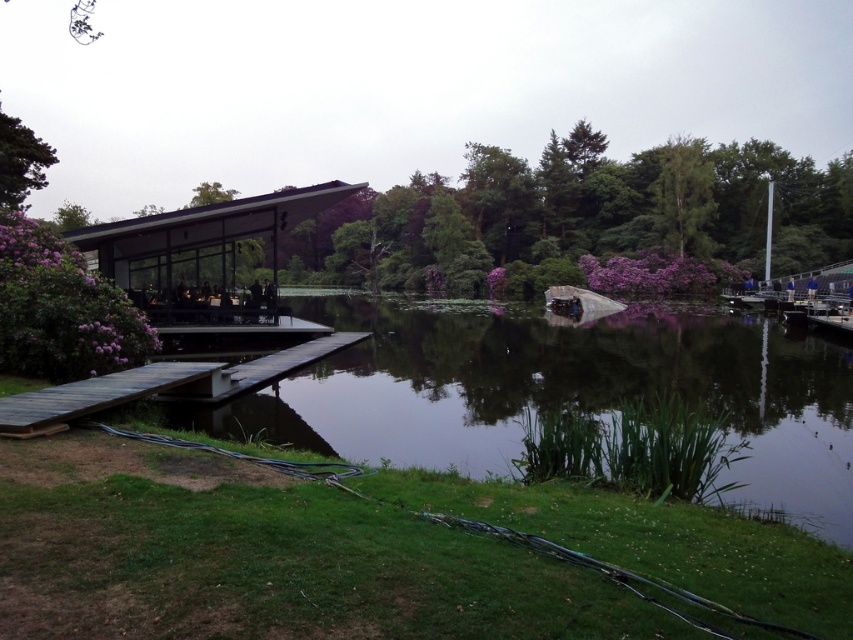
Between green leafy tree at upper right and green leafy tree at upper left, which one appears on the left side from the viewer's perspective?

From the viewer's perspective, green leafy tree at upper left appears more on the left side.

This screenshot has height=640, width=853. Describe the element at coordinates (683, 195) in the screenshot. I see `green leafy tree at upper right` at that location.

Who is more forward, (675, 173) or (24, 177)?

Point (24, 177) is in front.

Find the location of a particular element. The width and height of the screenshot is (853, 640). green leafy tree at upper right is located at coordinates (683, 195).

Between purple leafy tree at upper center and green leafy tree at upper right, which one has less height?

green leafy tree at upper right is shorter.

Which is in front, point (697, 184) or point (666, 234)?

Point (697, 184) is more forward.

Is point (566, 211) closer to camera compared to point (701, 220)?

No, (566, 211) is further to viewer.

At what (x,y) coordinates should I click in order to perform the action: click on purple leafy tree at upper center. Please return your answer as a coordinate pair (x, y). The height and width of the screenshot is (640, 853). Looking at the image, I should click on 589,211.

Does transparent glass water at center appear on the right side of metallic silver boat at center?

No, transparent glass water at center is not to the right of metallic silver boat at center.

Which is in front, point (805, 394) or point (570, 292)?

Point (805, 394) is more forward.

Is point (701, 337) positioned after point (579, 308)?

No, it is in front of (579, 308).

Find the location of a particular element. transparent glass water at center is located at coordinates tap(561, 392).